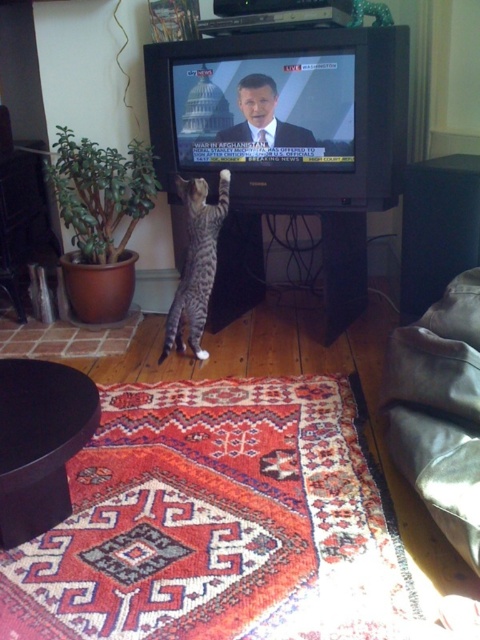
Is black plastic tv at center bigger than striped fur cat at center?

Indeed, black plastic tv at center has a larger size compared to striped fur cat at center.

Which is in front, point (338, 284) or point (204, 208)?

Point (204, 208)

Who is more distant from viewer, (244, 273) or (199, 179)?

Positioned behind is point (244, 273).

The width and height of the screenshot is (480, 640). What are the coordinates of `black plastic tv at center` in the screenshot? It's located at (285, 145).